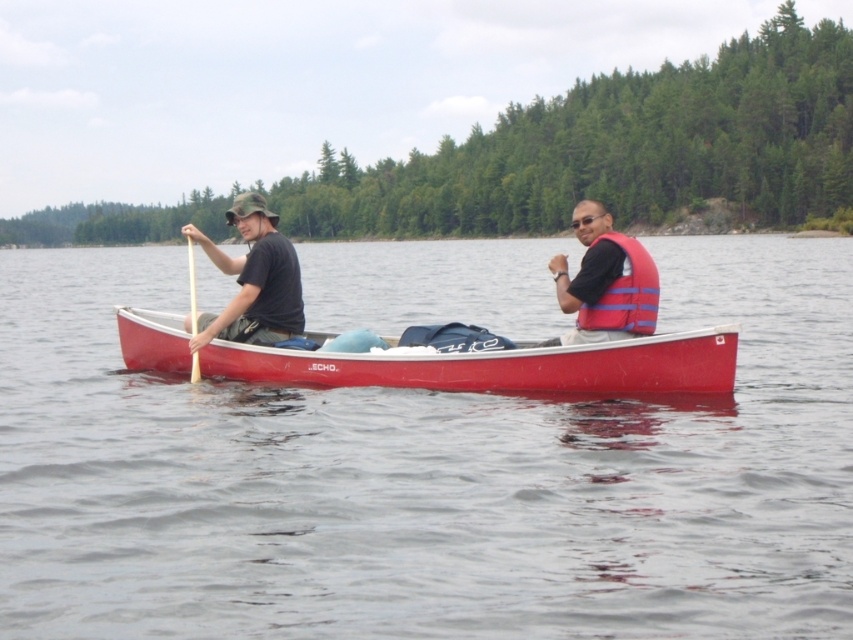
Question: Based on their relative distances, which object is farther from the matte black shirt at left?

Choices:
 (A) wooden paddle at center
 (B) transparent water at center

Answer: (B)

Question: Which of these objects is positioned closest to the red plastic canoe at center?

Choices:
 (A) matte black shirt at left
 (B) transparent water at center
 (C) blue fabric life jacket at center

Answer: (C)

Question: Is red plastic canoe at center in front of wooden paddle at center?

Choices:
 (A) no
 (B) yes

Answer: (B)

Question: Which of the following is the closest to the observer?

Choices:
 (A) (560, 243)
 (B) (625, 300)
 (C) (292, 372)

Answer: (B)

Question: Does red plastic canoe at center appear under matte black shirt at left?

Choices:
 (A) yes
 (B) no

Answer: (A)

Question: Can you confirm if matte black shirt at left is thinner than blue fabric life jacket at center?

Choices:
 (A) no
 (B) yes

Answer: (A)